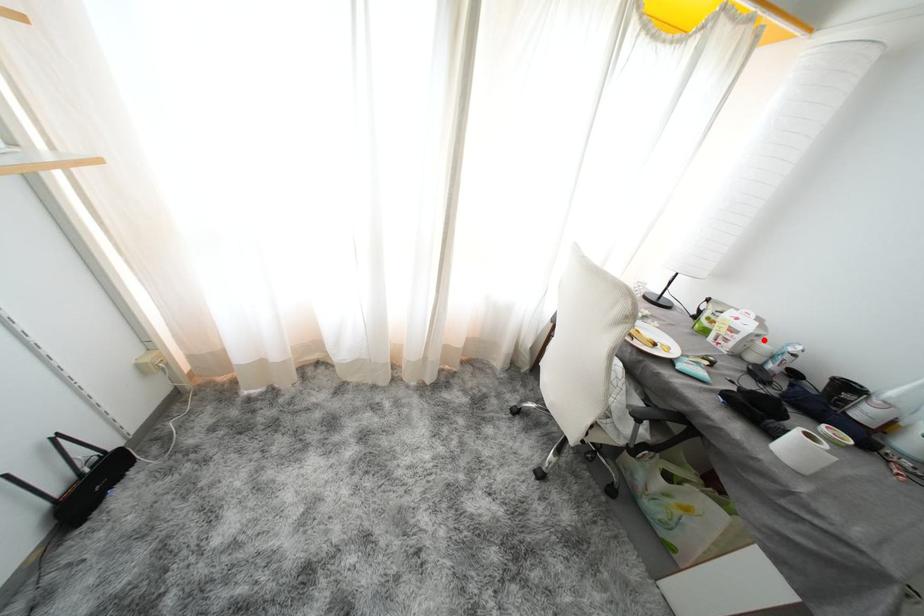
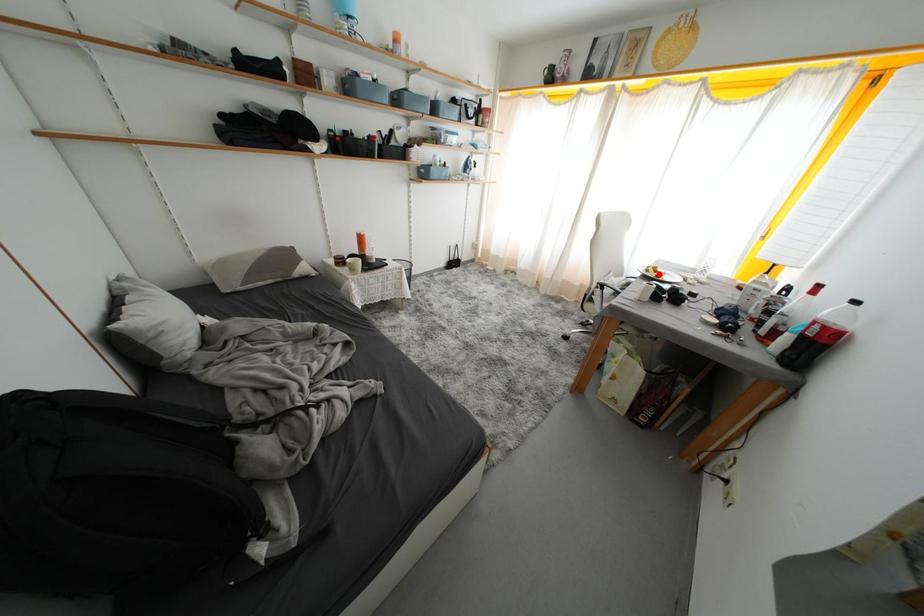
I am providing you with two images of the same scene from different viewpoints. A red point is marked on the first image and another point is marked on the second image. Is the marked point in image1 the same physical position as the marked point in image2?

No